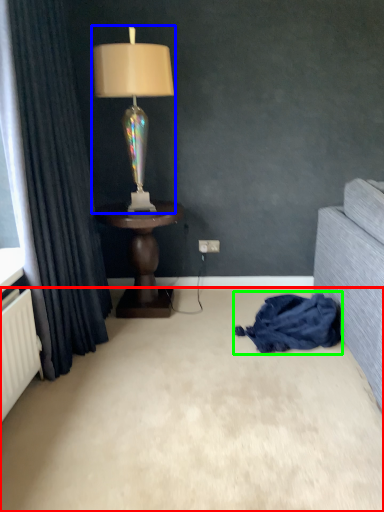
Question: Which is nearer to the plain (highlighted by a red box)? lamp (highlighted by a blue box) or blanket (highlighted by a green box).

Choices:
 (A) lamp
 (B) blanket

Answer: (B)